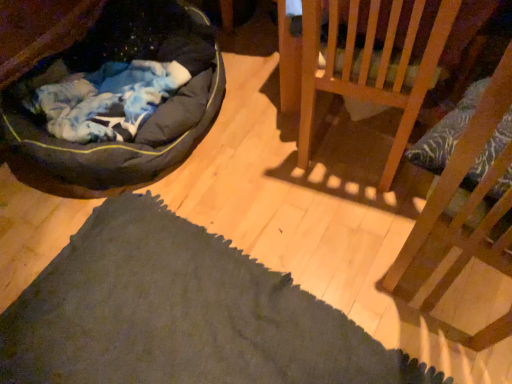
Question: From the image's perspective, is wooden chair at right, marked as the second furniture in a back-to-front arrangement, on top of wooden chair at upper right, arranged as the first furniture when viewed from the back?

Choices:
 (A) no
 (B) yes

Answer: (A)

Question: Is wooden chair at right, acting as the 1th furniture starting from the front, thinner than wooden chair at upper right, which is the 2th furniture in front-to-back order?

Choices:
 (A) no
 (B) yes

Answer: (A)

Question: Is wooden chair at right, acting as the 1th furniture starting from the front, touching wooden chair at upper right, arranged as the first furniture when viewed from the back?

Choices:
 (A) no
 (B) yes

Answer: (A)

Question: Is wooden chair at right, acting as the 1th furniture starting from the front, not near wooden chair at upper right, arranged as the first furniture when viewed from the back?

Choices:
 (A) no
 (B) yes

Answer: (A)

Question: Can you confirm if wooden chair at right, marked as the second furniture in a back-to-front arrangement, is smaller than wooden chair at upper right, which is the 2th furniture in front-to-back order?

Choices:
 (A) no
 (B) yes

Answer: (A)

Question: Is wooden chair at right, acting as the 1th furniture starting from the front, not inside wooden chair at upper right, which is the 2th furniture in front-to-back order?

Choices:
 (A) yes
 (B) no

Answer: (A)

Question: Is there a large distance between wooden chair at right, acting as the 1th furniture starting from the front, and dark gray fabric dog bed at left?

Choices:
 (A) no
 (B) yes

Answer: (B)

Question: Is wooden chair at right, marked as the second furniture in a back-to-front arrangement, smaller than dark gray fabric dog bed at left?

Choices:
 (A) yes
 (B) no

Answer: (A)

Question: Is wooden chair at right, marked as the second furniture in a back-to-front arrangement, to the left of dark gray fabric dog bed at left from the viewer's perspective?

Choices:
 (A) no
 (B) yes

Answer: (A)

Question: Is wooden chair at right, acting as the 1th furniture starting from the front, closer to the viewer compared to dark gray fabric dog bed at left?

Choices:
 (A) yes
 (B) no

Answer: (A)

Question: From the image's perspective, does wooden chair at right, marked as the second furniture in a back-to-front arrangement, appear lower than dark gray fabric dog bed at left?

Choices:
 (A) yes
 (B) no

Answer: (A)

Question: From a real-world perspective, is wooden chair at right, marked as the second furniture in a back-to-front arrangement, physically below dark gray fabric dog bed at left?

Choices:
 (A) yes
 (B) no

Answer: (B)

Question: Is wooden chair at upper right, arranged as the first furniture when viewed from the back, in front of dark gray fabric dog bed at left?

Choices:
 (A) yes
 (B) no

Answer: (B)